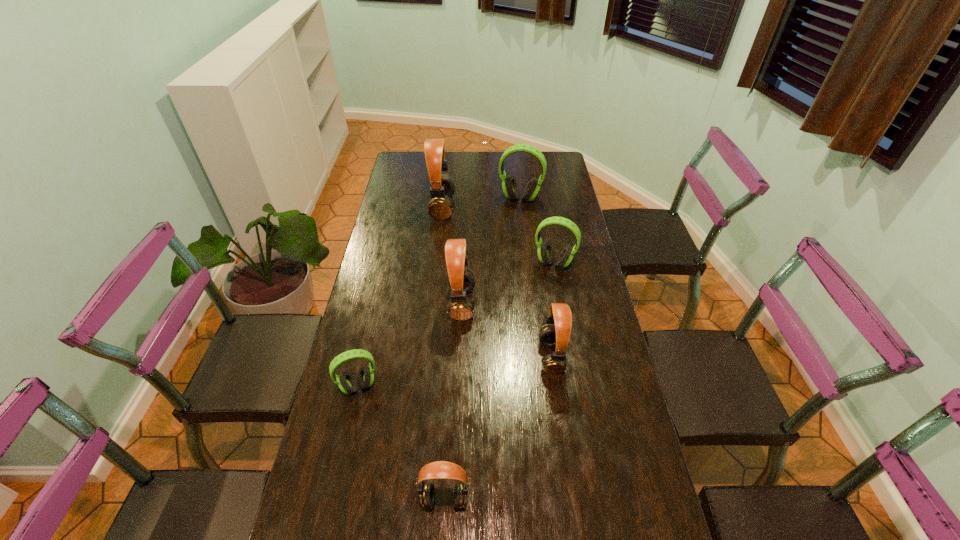
Find the location of a particular element. The image size is (960, 540). the smallest green headset is located at coordinates (347, 384).

Where is `the nearest headset`? the nearest headset is located at coordinates (441, 469).

Identify the location of the nearest brown headset. (441, 469).

At what (x,y) coordinates should I click in order to perform the action: click on vacant space situated 0.330m on the ear cups of the biggest brown headset. Please return your answer as a coordinate pair (x, y). Image resolution: width=960 pixels, height=540 pixels. Looking at the image, I should click on (531, 207).

Identify the location of vacant area situated on the ear cups of the third nearest brown headset. The height and width of the screenshot is (540, 960). (537, 303).

Locate an element on the screen. vacant area situated 0.280m on the front of the biggest green headset is located at coordinates (526, 248).

Locate an element on the screen. This screenshot has height=540, width=960. vacant space located 0.240m on the front of the third farthest headset is located at coordinates (564, 323).

Identify the location of vacant space located on the ear cups of the rightmost brown headset. The width and height of the screenshot is (960, 540). (416, 356).

At what (x,y) coordinates should I click in order to perform the action: click on vacant space located on the ear cups of the rightmost brown headset. Please return your answer as a coordinate pair (x, y). This screenshot has width=960, height=540. Looking at the image, I should click on (500, 356).

You are a GUI agent. You are given a task and a screenshot of the screen. Output one action in this format:
    pyautogui.click(x=<x>, y=<y>)
    Task: Click on the free location located on the ear cups of the rightmost brown headset
    
    Given the screenshot: What is the action you would take?
    pyautogui.click(x=487, y=356)